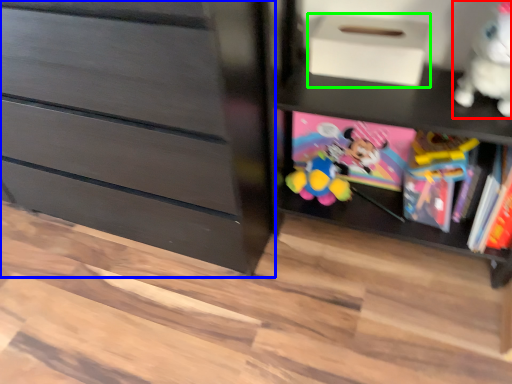
Question: Estimate the real-world distances between objects in this image. Which object is farther from toy (highlighted by a red box), chest of drawers (highlighted by a blue box) or shoe box (highlighted by a green box)?

Choices:
 (A) chest of drawers
 (B) shoe box

Answer: (A)